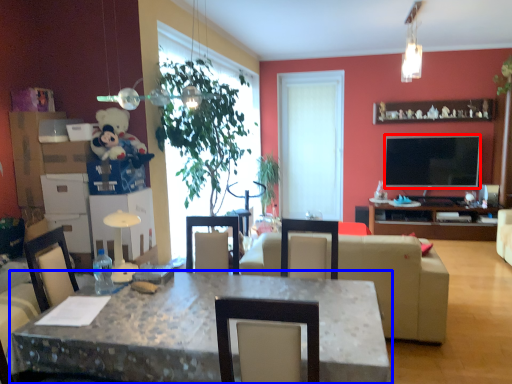
Question: Which of the following is the farthest to the observer, television (highlighted by a red box) or desk (highlighted by a blue box)?

Choices:
 (A) television
 (B) desk

Answer: (A)